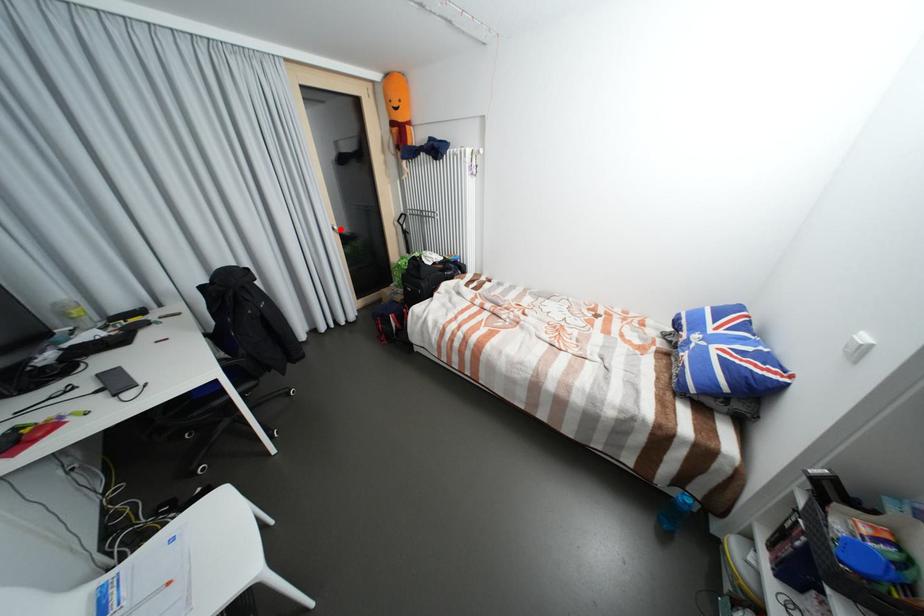
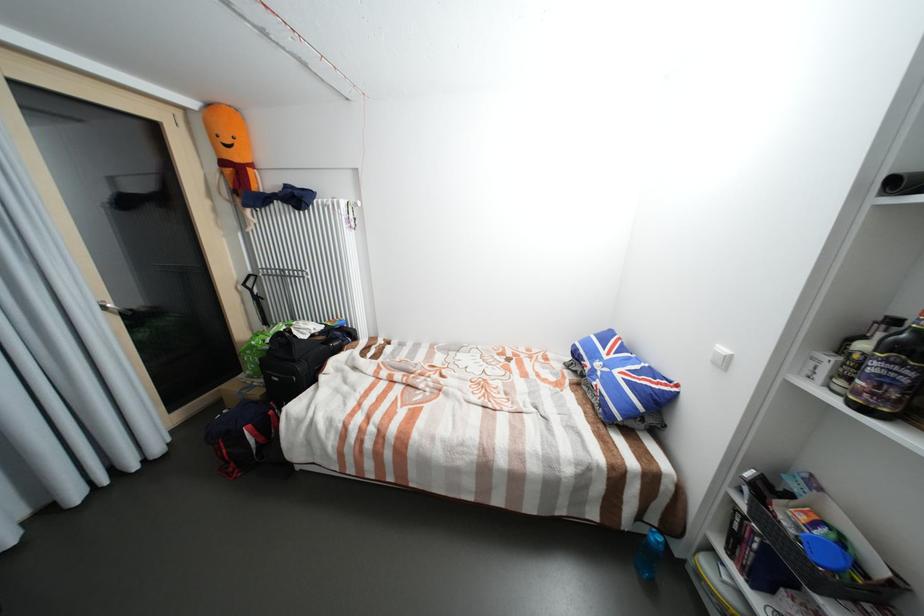
Question: I am providing you with two images of the same scene from different viewpoints. Given a red point in image1, look at the same physical point in image2. Is it:

Choices:
 (A) Closer to the viewpoint
 (B) Farther from the viewpoint

Answer: (B)